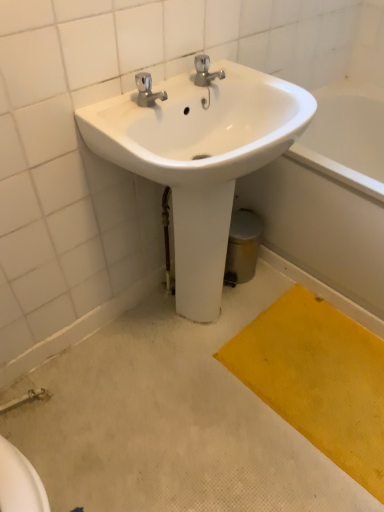
Question: Does white glossy bathtub at lower right have a greater width compared to yellow fabric doormat at lower right?

Choices:
 (A) yes
 (B) no

Answer: (A)

Question: Considering the relative sizes of white glossy bathtub at lower right and yellow fabric doormat at lower right in the image provided, is white glossy bathtub at lower right thinner than yellow fabric doormat at lower right?

Choices:
 (A) yes
 (B) no

Answer: (B)

Question: Could you tell me if white glossy bathtub at lower right is turned towards yellow fabric doormat at lower right?

Choices:
 (A) no
 (B) yes

Answer: (B)

Question: Does white glossy bathtub at lower right have a larger size compared to yellow fabric doormat at lower right?

Choices:
 (A) no
 (B) yes

Answer: (B)

Question: Can you confirm if white glossy bathtub at lower right is positioned to the left of yellow fabric doormat at lower right?

Choices:
 (A) no
 (B) yes

Answer: (A)

Question: Is white glossy bathtub at lower right at the right side of yellow fabric doormat at lower right?

Choices:
 (A) no
 (B) yes

Answer: (B)

Question: Is yellow fabric doormat at lower right far from white glossy bathtub at lower right?

Choices:
 (A) no
 (B) yes

Answer: (A)

Question: Is yellow fabric doormat at lower right positioned with its back to white glossy bathtub at lower right?

Choices:
 (A) yes
 (B) no

Answer: (A)

Question: Is yellow fabric doormat at lower right thinner than white glossy bathtub at lower right?

Choices:
 (A) no
 (B) yes

Answer: (B)

Question: Considering the relative sizes of yellow fabric doormat at lower right and white glossy bathtub at lower right in the image provided, is yellow fabric doormat at lower right shorter than white glossy bathtub at lower right?

Choices:
 (A) yes
 (B) no

Answer: (A)

Question: From the image's perspective, does yellow fabric doormat at lower right appear lower than white glossy bathtub at lower right?

Choices:
 (A) no
 (B) yes

Answer: (B)

Question: Can you confirm if yellow fabric doormat at lower right is wider than white glossy bathtub at lower right?

Choices:
 (A) no
 (B) yes

Answer: (A)

Question: Is white glossy bathtub at lower right further to camera compared to white glossy sink at upper center?

Choices:
 (A) no
 (B) yes

Answer: (B)